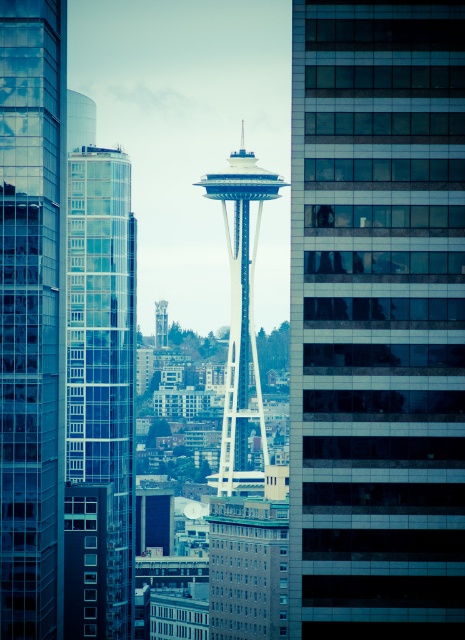
You are standing at a viewpoint in the city and see two points in the scene. The first point is labeled as point (x=13, y=509) and the second is point (x=80, y=404). Based on their positions, which point is closer to you?

Point (x=80, y=404) is closer to you because it is in front of point (x=13, y=509), which is behind it.

You are standing at point (32,314) in the cityscape. What object is located at your current position?

The transparent glass skyscraper at left is located at point (32,314).

You are a drone operator who needs to fly a drone between the transparent glass skyscraper at left and the Space Needle lookalike tower in the center. What is the minimum distance the drone must maintain between them to avoid collision?

The minimum distance the drone must maintain between the transparent glass skyscraper at left and the Space Needle lookalike tower in the center is 651.58 meters to avoid collision.